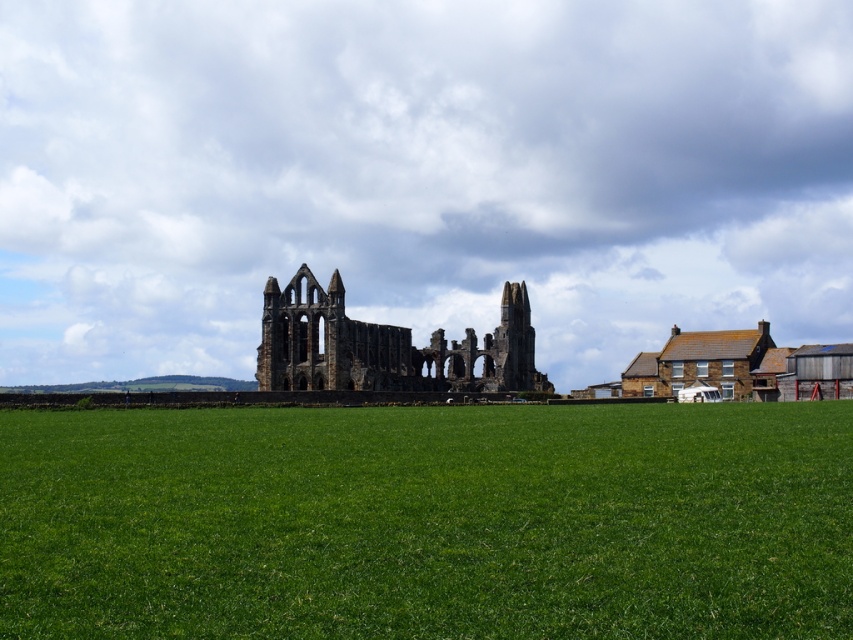
Question: Which of the following is the farthest from the observer?

Choices:
 (A) (469, 627)
 (B) (518, 388)

Answer: (B)

Question: Which of the following is the farthest from the observer?

Choices:
 (A) green grass at center
 (B) stone ruins at center

Answer: (B)

Question: Can you confirm if green grass at center is thinner than stone ruins at center?

Choices:
 (A) no
 (B) yes

Answer: (A)

Question: In this image, where is green grass at center located relative to stone ruins at center?

Choices:
 (A) left
 (B) right

Answer: (B)

Question: Does green grass at center have a larger size compared to stone ruins at center?

Choices:
 (A) yes
 (B) no

Answer: (A)